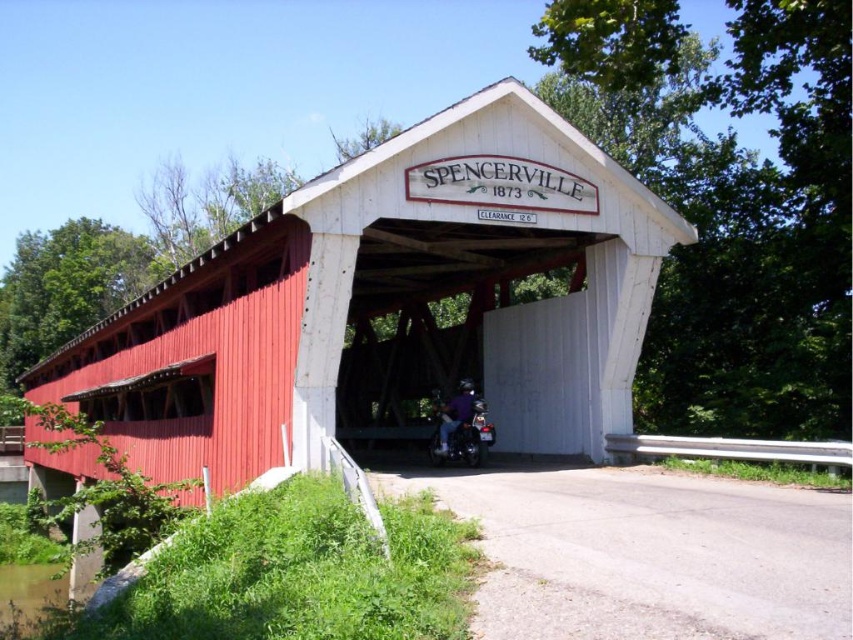
Which of these two, red corrugated metal bridge at center or shiny black motorcycle at center, stands shorter?

shiny black motorcycle at center

Which is below, red corrugated metal bridge at center or shiny black motorcycle at center?

red corrugated metal bridge at center

Find the location of a particular element. red corrugated metal bridge at center is located at coordinates (387, 300).